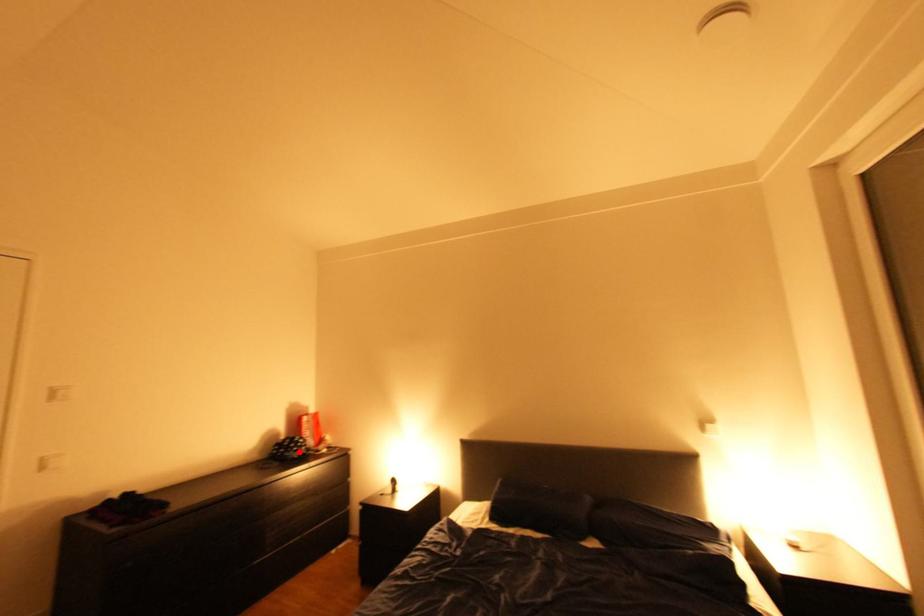
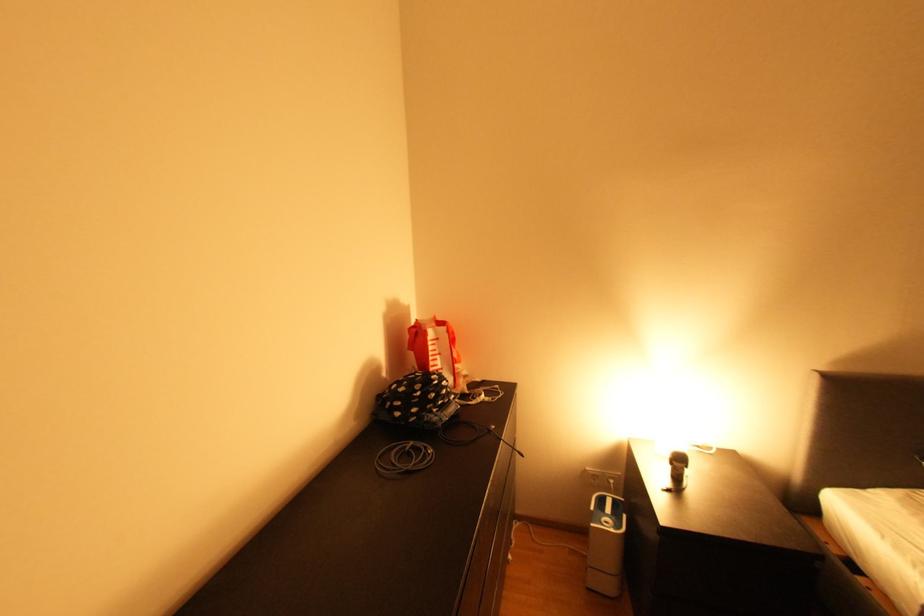
The point at the highlighted location is marked in the first image. Where is the corresponding point in the second image?

(441, 411)